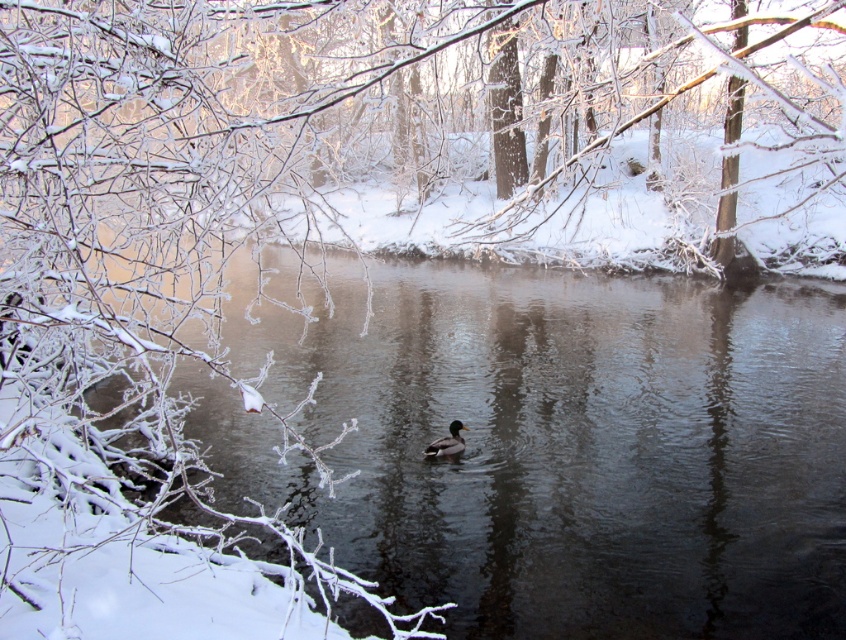
Is clear water at center to the left of brown matte duck at center from the viewer's perspective?

Correct, you'll find clear water at center to the left of brown matte duck at center.

What do you see at coordinates (553, 444) in the screenshot?
I see `clear water at center` at bounding box center [553, 444].

Identify the location of clear water at center. (553, 444).